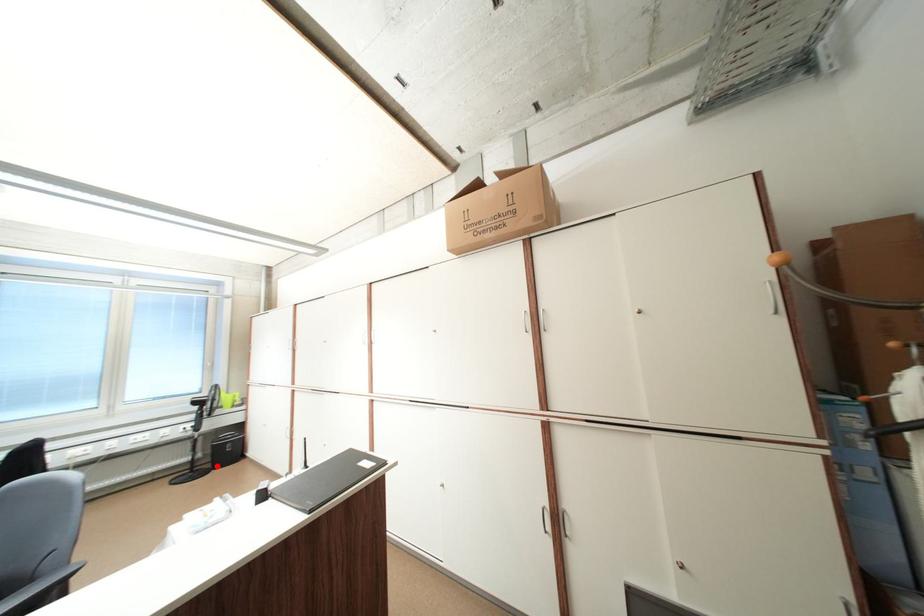
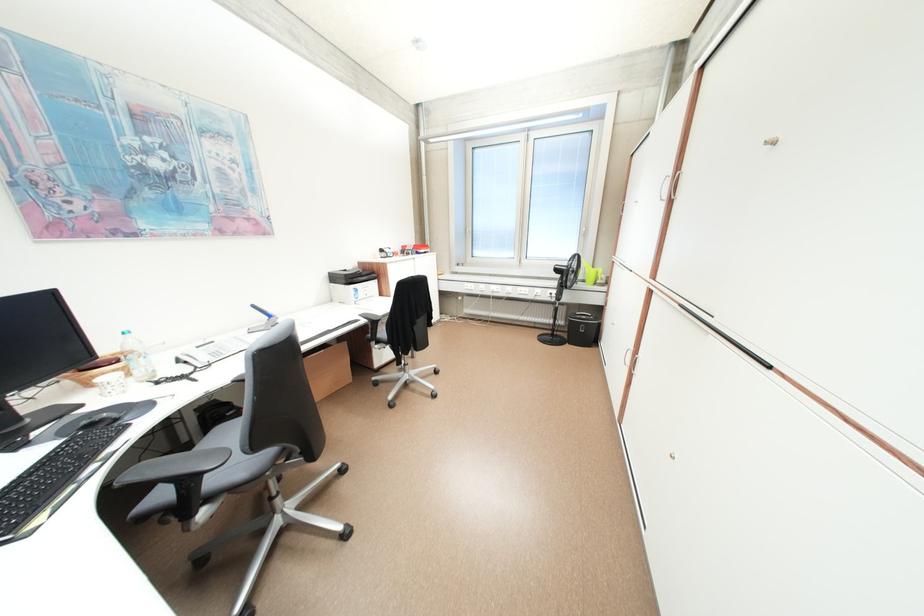
Question: I am providing you with two images of the same scene from different viewpoints. Image1 has a red point marked. In image2, the corresponding 3D location appears at what relative position? Reply with the corresponding letter.

Choices:
 (A) Closer
 (B) Farther

Answer: (A)